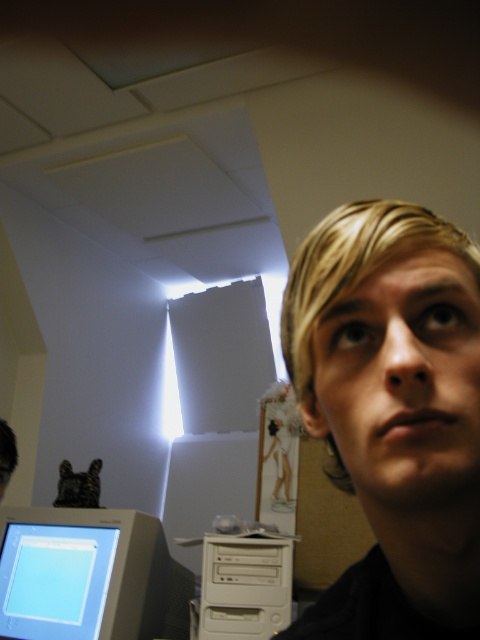
Where is the blonde hair at right located in the image?

The blonde hair at right is located at point coordinates of approximately 0.644 on the x axis and 0.819 on the y axis.

You are setting up a new desk and want to place the beige plastic monitor at bottom left and the white plastic computer at center. Since you have limited vertical space, which object should you prioritize placing first to ensure it fits?

The beige plastic monitor at bottom left is much taller than the white plastic computer at center, so you should prioritize placing the beige plastic monitor at bottom left first to accommodate its height.